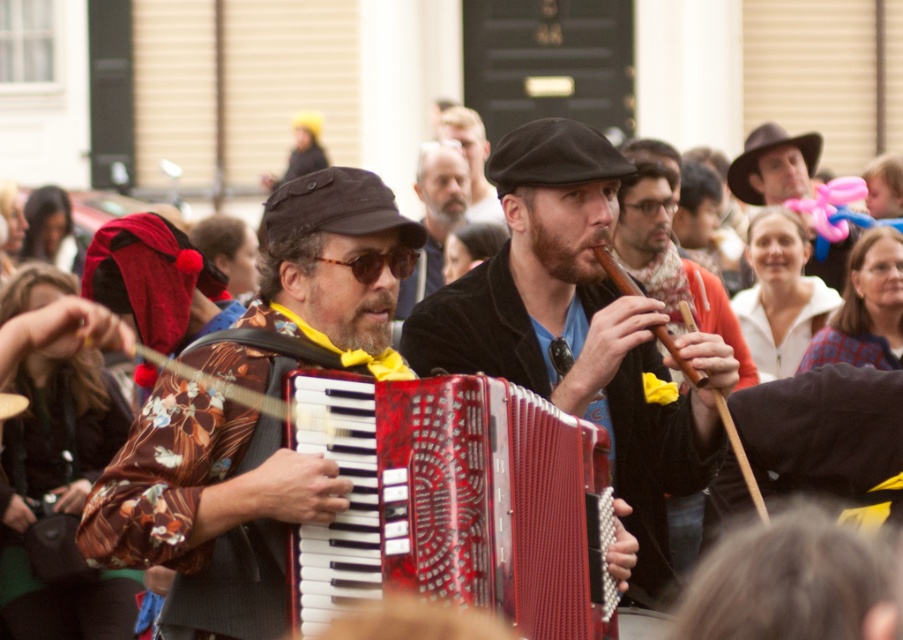
Question: Considering the real-world distances, which object is closest to the matte black accordion at center?

Choices:
 (A) matte black hat at upper right
 (B) matte black hat at center
 (C) wooden flute at center
 (D) floral fabric shirt at center

Answer: (C)

Question: Is shiny red accordion at center wider than floral fabric shirt at center?

Choices:
 (A) no
 (B) yes

Answer: (A)

Question: Which of the following is the closest to the observer?

Choices:
 (A) (444, 116)
 (B) (742, 476)
 (C) (447, 195)
 (D) (281, 323)

Answer: (D)

Question: From the image, what is the correct spatial relationship of matte black hat at upper right in relation to wooden flute at center?

Choices:
 (A) below
 (B) above

Answer: (B)

Question: Estimate the real-world distances between objects in this image. Which object is farther from the shiny red accordion at center?

Choices:
 (A) floral fabric shirt at center
 (B) matte black hat at upper right
 (C) matte black hat at center

Answer: (C)

Question: Does wooden flute at center come in front of matte black hat at center?

Choices:
 (A) no
 (B) yes

Answer: (B)